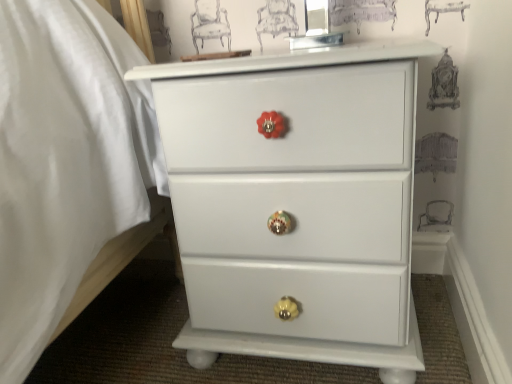
What is the approximate height of white glossy chest of drawers at center?

23.27 inches.

What do you see at coordinates (296, 203) in the screenshot? The width and height of the screenshot is (512, 384). I see `white glossy chest of drawers at center` at bounding box center [296, 203].

You are a GUI agent. You are given a task and a screenshot of the screen. Output one action in this format:
    pyautogui.click(x=<x>, y=<y>)
    Task: Click on the white glossy chest of drawers at center
    The width and height of the screenshot is (512, 384).
    Given the screenshot: What is the action you would take?
    pyautogui.click(x=296, y=203)

Where is `white glossy chest of drawers at center`? white glossy chest of drawers at center is located at coordinates (296, 203).